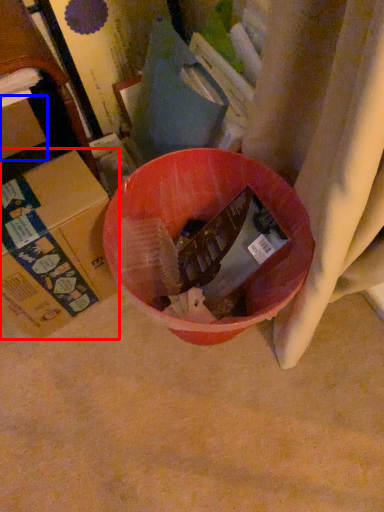
Question: Which point is further to the camera, cardboard box (highlighted by a red box) or cardboard box (highlighted by a blue box)?

Choices:
 (A) cardboard box
 (B) cardboard box

Answer: (B)